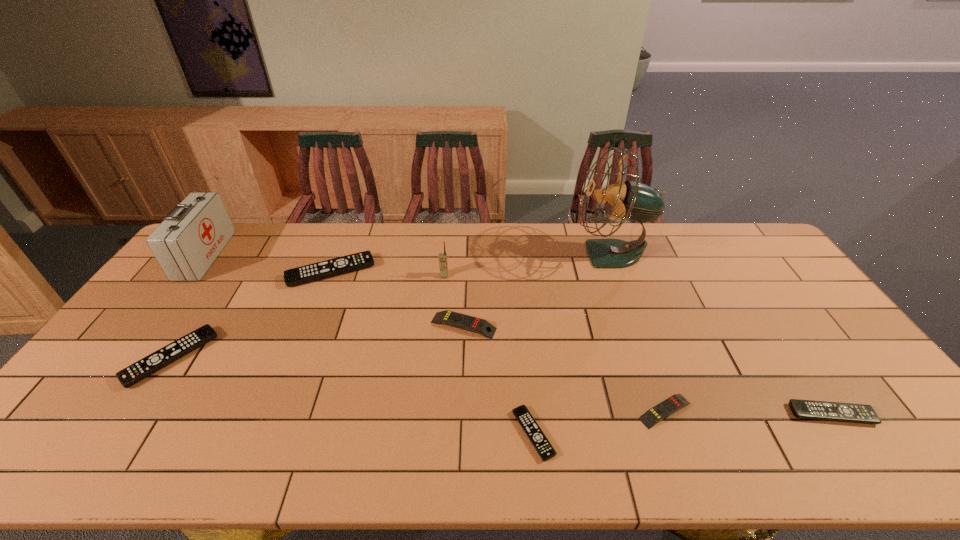
You are a GUI agent. You are given a task and a screenshot of the screen. Output one action in this format:
    pyautogui.click(x=<x>, y=<y>)
    Task: Click on the tallest object
    Image resolution: width=960 pixels, height=540 pixels.
    Given the screenshot: What is the action you would take?
    pyautogui.click(x=632, y=200)

Find the location of a particular element. This screenshot has height=540, width=960. fan is located at coordinates (632, 200).

The width and height of the screenshot is (960, 540). Find the location of `the eighth shortest object`. the eighth shortest object is located at coordinates (190, 238).

Locate an element on the screen. Image resolution: width=960 pixels, height=540 pixels. the first-aid kit is located at coordinates (190, 238).

Locate an element on the screen. This screenshot has height=540, width=960. cellular telephone is located at coordinates (443, 264).

This screenshot has width=960, height=540. Identify the location of the farthest black remote control. (356, 261).

This screenshot has height=540, width=960. I want to click on the third black remote control from right to left, so click(x=356, y=261).

Locate an element on the screen. the bigger yellow remote control is located at coordinates (450, 318).

You are a GUI agent. You are given a task and a screenshot of the screen. Output one action in this format:
    pyautogui.click(x=<x>, y=<y>)
    Task: Click on the left yellow remote control
    
    Given the screenshot: What is the action you would take?
    pyautogui.click(x=450, y=318)

I want to click on the second biggest black remote control, so pos(159,359).